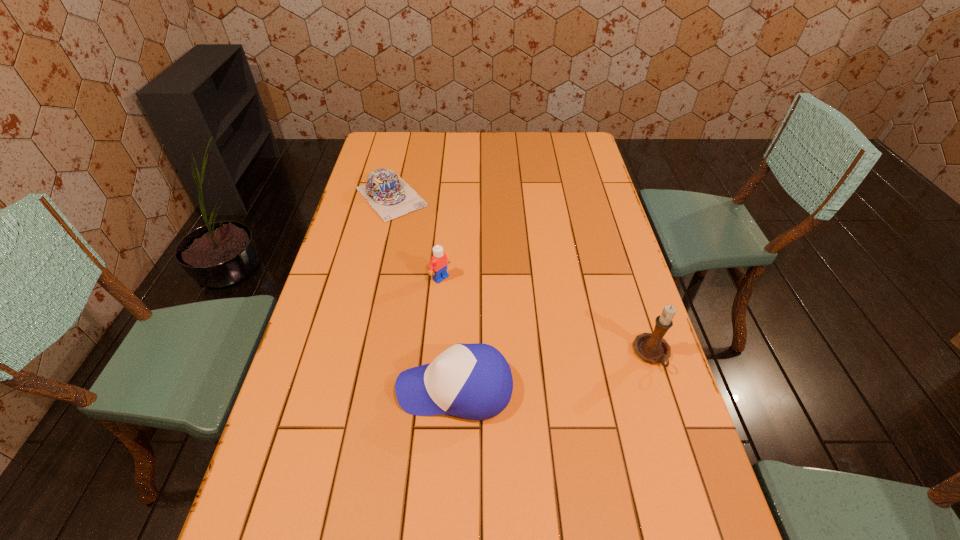
In order to click on vacant area at the right edge of the desktop in this screenshot , I will do `click(622, 266)`.

Identify the location of free space at the near left corner. (322, 511).

The height and width of the screenshot is (540, 960). Identify the location of vacant area between the farthest object and the third nearest object. (416, 237).

The height and width of the screenshot is (540, 960). In order to click on vacant region between the third nearest object and the tallest object in this screenshot , I will do [x=546, y=316].

What are the coordinates of `free space between the third nearest object and the tallest object` in the screenshot? It's located at (546, 316).

This screenshot has height=540, width=960. I want to click on vacant space that is in between the baseball cap and the Lego, so click(447, 333).

This screenshot has width=960, height=540. Find the location of `vacant space in between the Lego and the baseball cap`. vacant space in between the Lego and the baseball cap is located at coordinates (447, 333).

Image resolution: width=960 pixels, height=540 pixels. What are the coordinates of `vacant area that lies between the tallest object and the baseball cap` in the screenshot? It's located at (554, 372).

You are a GUI agent. You are given a task and a screenshot of the screen. Output one action in this format:
    pyautogui.click(x=<x>, y=<y>)
    Task: Click on the free space between the baseball cap and the shortest object
    The image size is (960, 540).
    Given the screenshot: What is the action you would take?
    pyautogui.click(x=423, y=293)

This screenshot has height=540, width=960. What are the coordinates of `free point between the baseball cap and the second farthest object` in the screenshot? It's located at (447, 333).